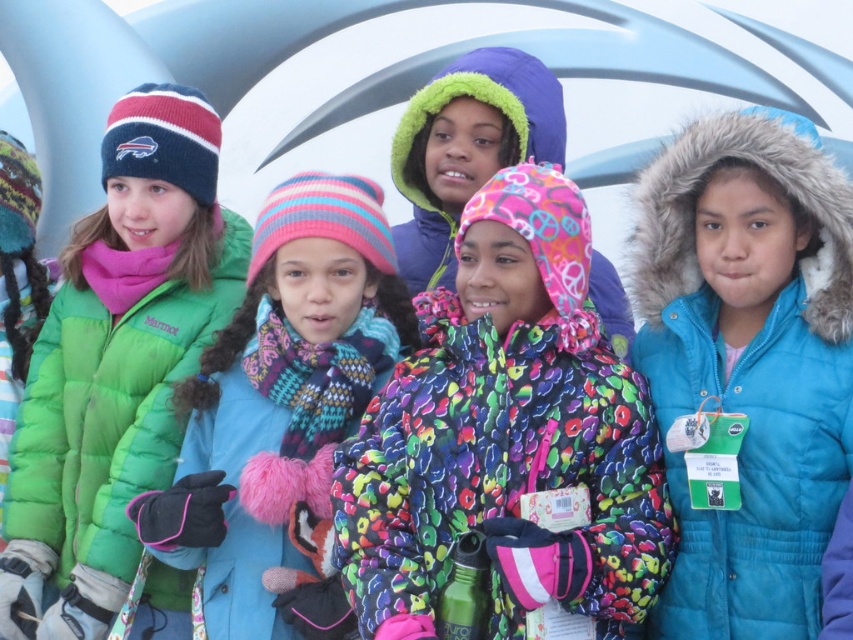
Question: Which object is positioned closest to the green puffy coat at left?

Choices:
 (A) blue fuzzy coat at right
 (B) floral-patterned jacket at center
 (C) multicolored fleece jacket at center

Answer: (B)

Question: Among these objects, which one is nearest to the camera?

Choices:
 (A) pink knitted hat at center
 (B) blue fuzzy coat at right
 (C) floral-patterned jacket at center

Answer: (C)

Question: Is floral-patterned jacket at center positioned behind green puffy coat at left?

Choices:
 (A) no
 (B) yes

Answer: (A)

Question: Which of these objects is positioned farthest from the green puffy coat at left?

Choices:
 (A) floral-patterned jacket at center
 (B) pink knitted hat at center

Answer: (A)

Question: Does pink knitted hat at center have a smaller size compared to multicolored fleece jacket at center?

Choices:
 (A) yes
 (B) no

Answer: (B)

Question: Does blue fuzzy coat at right appear on the right side of pink knitted hat at center?

Choices:
 (A) yes
 (B) no

Answer: (A)